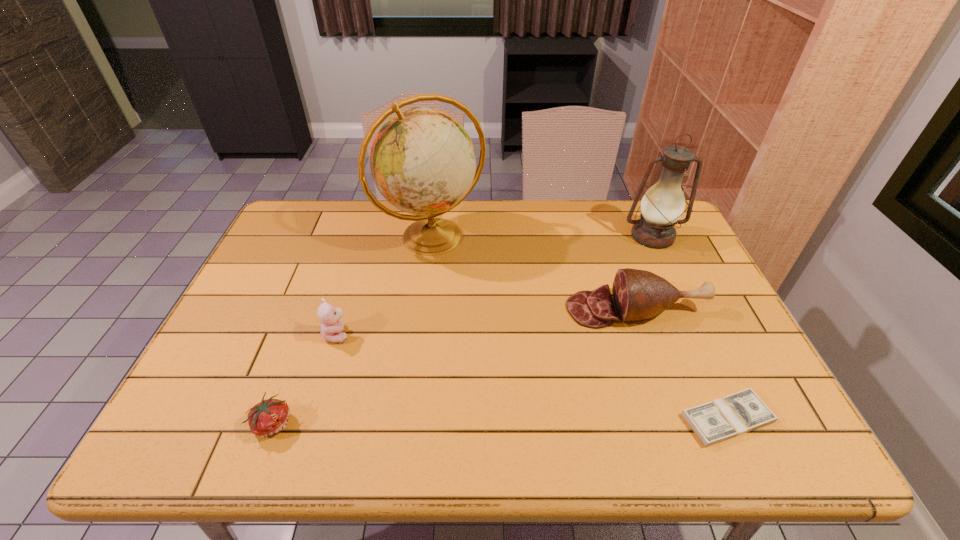
Find the location of a particular element. The image size is (960, 540). free spot between the tomato and the fifth shortest object is located at coordinates (463, 330).

Identify the location of vacant point located between the oil lamp and the tomato. Image resolution: width=960 pixels, height=540 pixels. (463, 330).

The image size is (960, 540). I want to click on vacant area between the tallest object and the second object from left to right, so click(x=385, y=286).

Locate an element on the screen. unoccupied area between the teddy bear and the third object from left to right is located at coordinates (385, 286).

This screenshot has height=540, width=960. I want to click on free space between the second shortest object and the fourth object from right to left, so pos(352,330).

Find the location of a particular element. This screenshot has width=960, height=540. empty space between the shortest object and the ham is located at coordinates [682, 364].

At what (x,y) coordinates should I click in order to perform the action: click on unoccupied area between the teddy bear and the oil lamp. Please return your answer as a coordinate pair (x, y). Looking at the image, I should click on (495, 285).

Identify which object is located as the nearest to the second object from left to right. Please provide its 2D coordinates. Your answer should be formatted as a tuple, i.e. [(x, y)], where the tuple contains the x and y coordinates of a point satisfying the conditions above.

[(267, 418)]

Image resolution: width=960 pixels, height=540 pixels. I want to click on the third closest object to the shortest object, so click(422, 160).

Identify the location of vacant space that satisfies the following two spatial constraints: 1. at the face of the shortest object; 2. on the left side of the teddy bear. (311, 419).